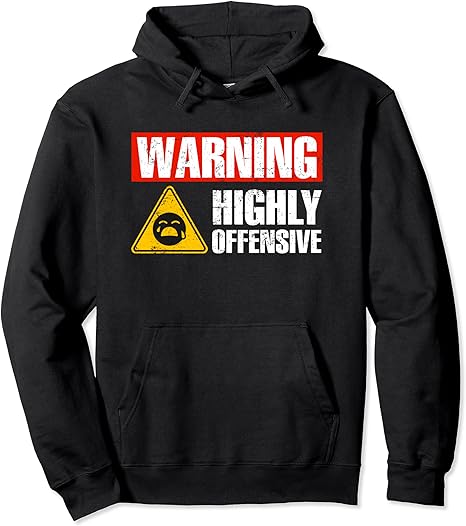
At what (x,y) coordinates should I click in order to perform the action: click on hood. Please return your answer as a coordinate pair (x, y). The width and height of the screenshot is (466, 526). Looking at the image, I should click on point(164,34), point(212,16), point(307,37).